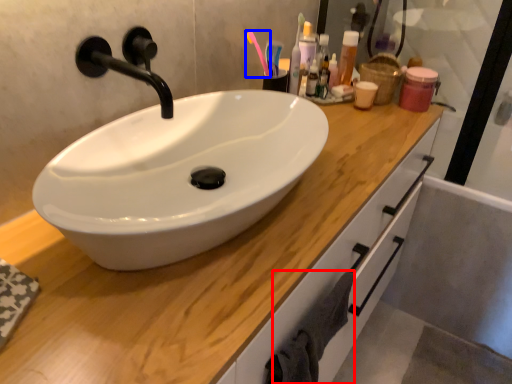
Question: Which of the following is the closest to the observer, bath towel (highlighted by a red box) or toothbrush (highlighted by a blue box)?

Choices:
 (A) bath towel
 (B) toothbrush

Answer: (A)